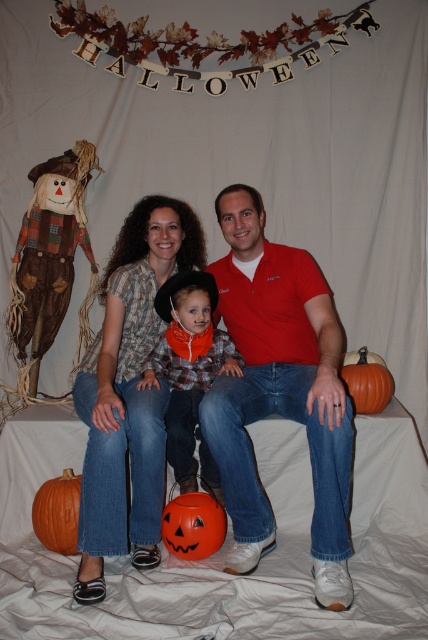
What are the coordinates of the red cotton shirt at center in the image?

The red cotton shirt at center is located at point [279,390].

You are a photographer setting up for a Halloween family photo. You have two shirts to place in front of the family for the shoot. The red cotton shirt at center and the plaid fabric shirt at center. According to the scene description, which shirt should be placed to the right to match the original setup?

The red cotton shirt at center should be placed to the right of the plaid fabric shirt at center to match the original setup.